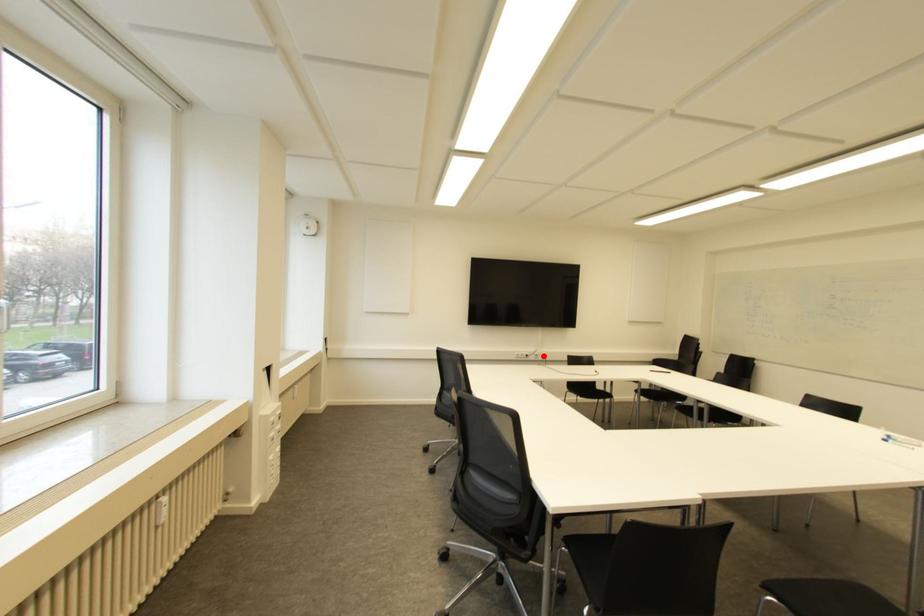
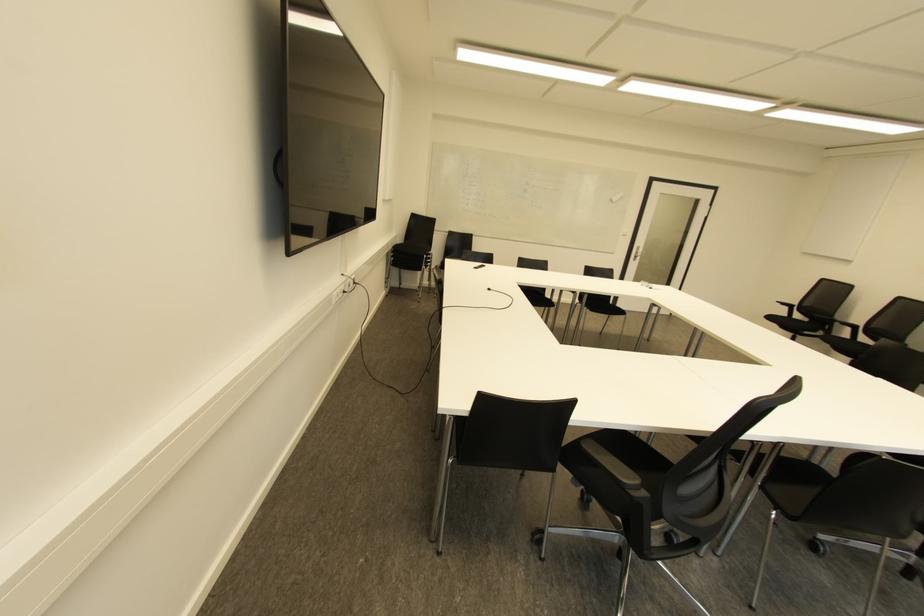
Locate, in the second image, the point that corresponds to the highlighted location in the first image.

(354, 282)